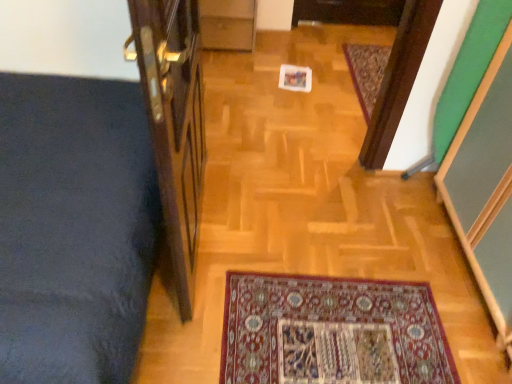
Question: Considering the relative sizes of carpeted mat at center and wooden door at left in the image provided, is carpeted mat at center wider than wooden door at left?

Choices:
 (A) yes
 (B) no

Answer: (A)

Question: Is there a large distance between carpeted mat at center and wooden door at left?

Choices:
 (A) yes
 (B) no

Answer: (A)

Question: From the image's perspective, does carpeted mat at center appear higher than wooden door at left?

Choices:
 (A) no
 (B) yes

Answer: (B)

Question: From the image's perspective, would you say carpeted mat at center is shown under wooden door at left?

Choices:
 (A) yes
 (B) no

Answer: (B)

Question: Is carpeted mat at center next to wooden door at left and touching it?

Choices:
 (A) no
 (B) yes

Answer: (A)

Question: Is carpeted mat at center shorter than wooden door at left?

Choices:
 (A) yes
 (B) no

Answer: (A)

Question: From a real-world perspective, is wooden door at left physically below carpeted mat at center?

Choices:
 (A) no
 (B) yes

Answer: (A)

Question: From the image's perspective, is wooden door at left above carpeted mat at center?

Choices:
 (A) yes
 (B) no

Answer: (B)

Question: Is wooden door at left oriented away from carpeted mat at center?

Choices:
 (A) no
 (B) yes

Answer: (A)

Question: Is wooden door at left wider than carpeted mat at center?

Choices:
 (A) no
 (B) yes

Answer: (A)

Question: Is wooden door at left not near carpeted mat at center?

Choices:
 (A) yes
 (B) no

Answer: (A)

Question: Can you confirm if wooden door at left is positioned to the right of carpeted mat at center?

Choices:
 (A) no
 (B) yes

Answer: (A)

Question: Considering their positions, is carpeted mat at center located in front of or behind wooden door at left?

Choices:
 (A) behind
 (B) front

Answer: (A)